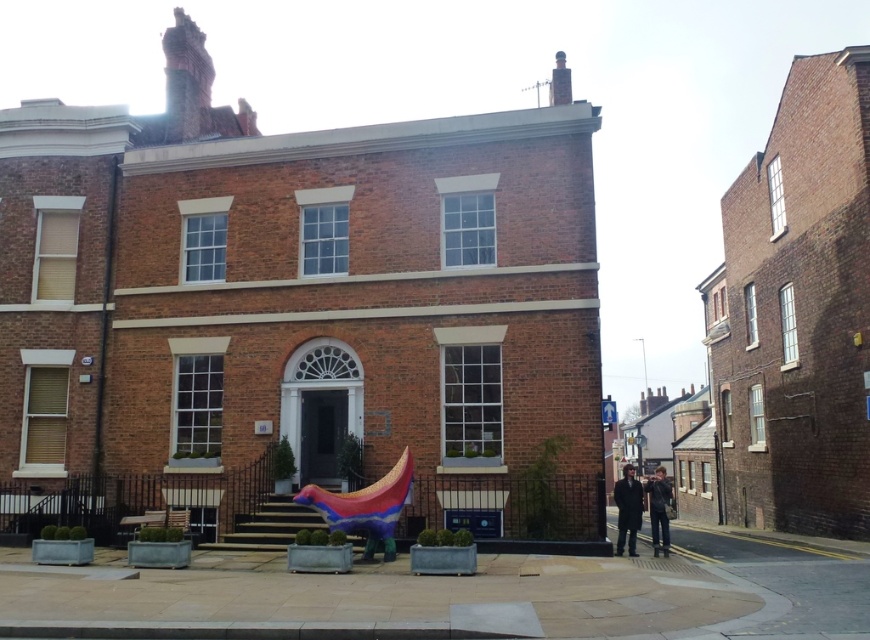
You are standing in front of the two story brick building and see the dark brown leather coat at lower right and the dark blue jeans at lower right. Which item is closer to you?

The dark brown leather coat at lower right is closer to you because it is in front of the dark blue jeans at lower right.

You are a delivery person approaching the building and need to place a package on the ground near the dark brown leather coat at lower right and dark blue jeans at lower right. Can you confirm if the coat is positioned higher than the jeans?

The dark brown leather coat at lower right is above the dark blue jeans at lower right, so yes, the coat is positioned higher than the jeans.